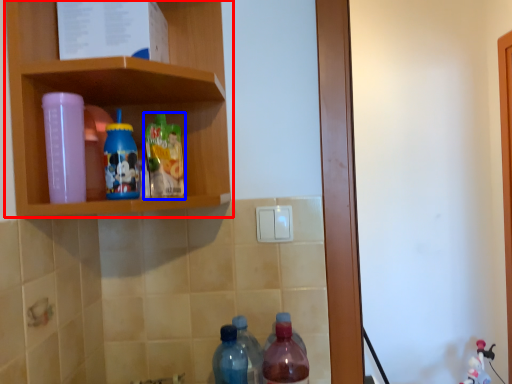
Question: Which of the following is the farthest to the observer, shelf (highlighted by a red box) or bottle (highlighted by a blue box)?

Choices:
 (A) shelf
 (B) bottle

Answer: (B)